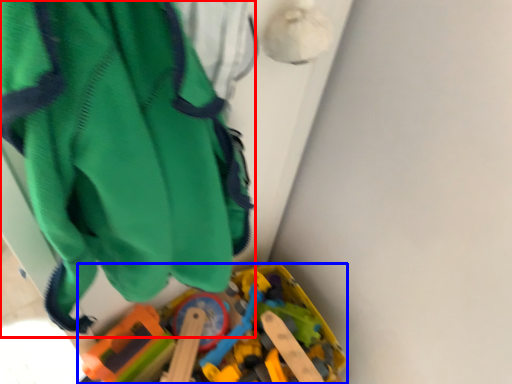
Question: Which point is closer to the camera, wide (highlighted by a red box) or toy (highlighted by a blue box)?

Choices:
 (A) wide
 (B) toy

Answer: (A)